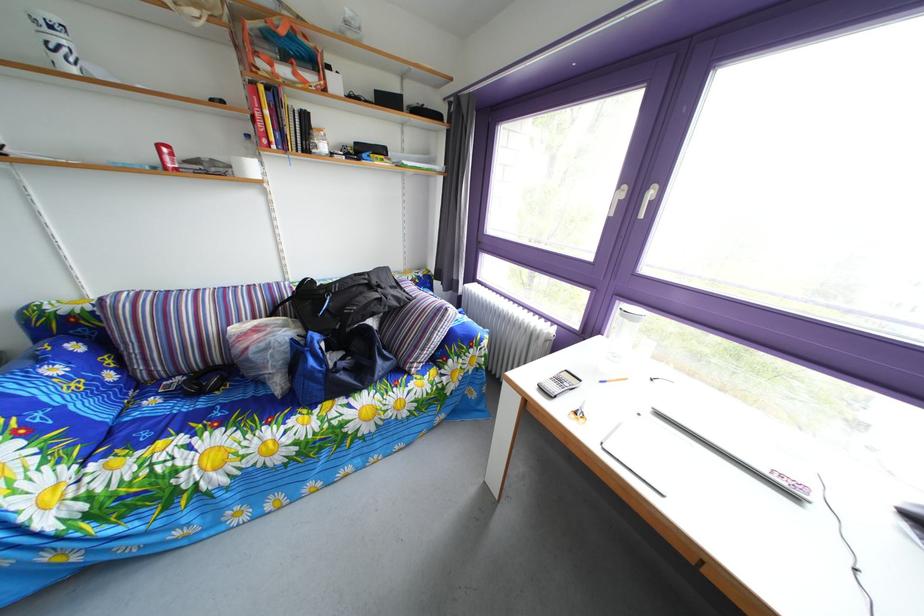
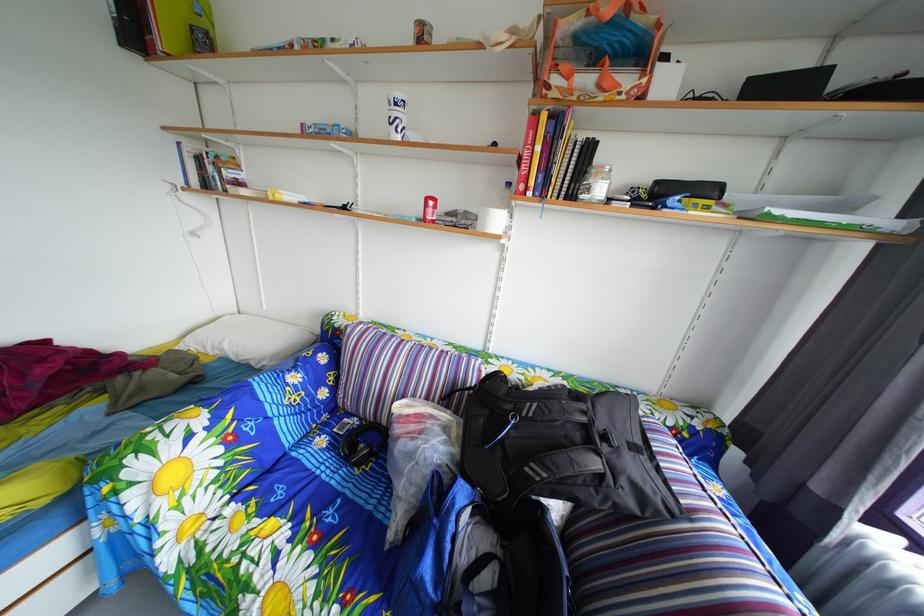
In the second image, find the point that corresponds to point (403, 296) in the first image.

(643, 456)